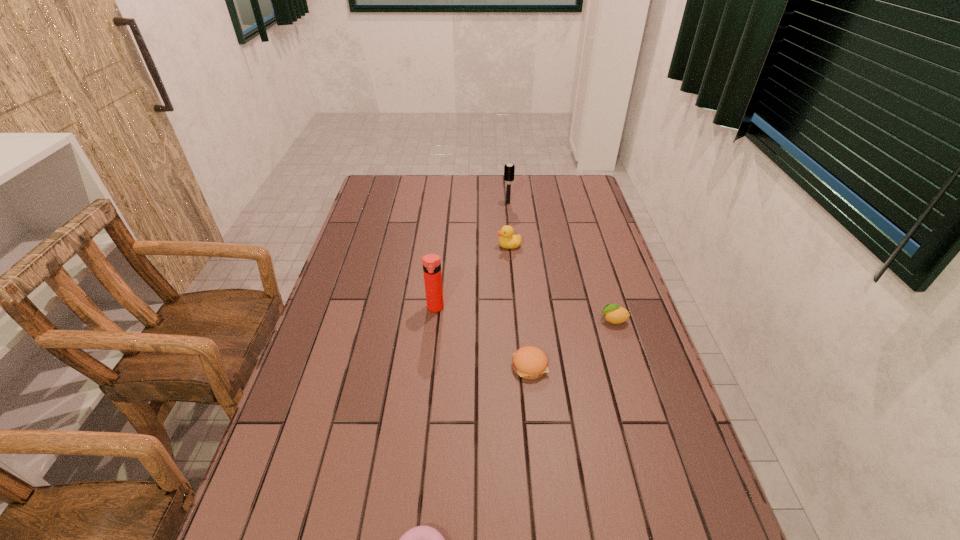
Locate an element on the screen. thermos bottle is located at coordinates (431, 263).

Image resolution: width=960 pixels, height=540 pixels. I want to click on hairbrush, so click(509, 169).

Locate an element on the screen. Image resolution: width=960 pixels, height=540 pixels. the farthest object is located at coordinates (509, 169).

Locate an element on the screen. The image size is (960, 540). the second farthest object is located at coordinates (507, 240).

The width and height of the screenshot is (960, 540). In order to click on duckling in this screenshot , I will do [507, 240].

This screenshot has width=960, height=540. I want to click on lemon, so click(614, 314).

Find the location of `the rightmost object`. the rightmost object is located at coordinates (614, 314).

Find the location of a particular element. Image resolution: width=960 pixels, height=540 pixels. patty is located at coordinates (529, 362).

Where is `vacant space located 0.240m on the right of the thermos bottle`? Image resolution: width=960 pixels, height=540 pixels. vacant space located 0.240m on the right of the thermos bottle is located at coordinates (524, 308).

Locate an element on the screen. vacant space located on the left of the fifth shortest object is located at coordinates (457, 203).